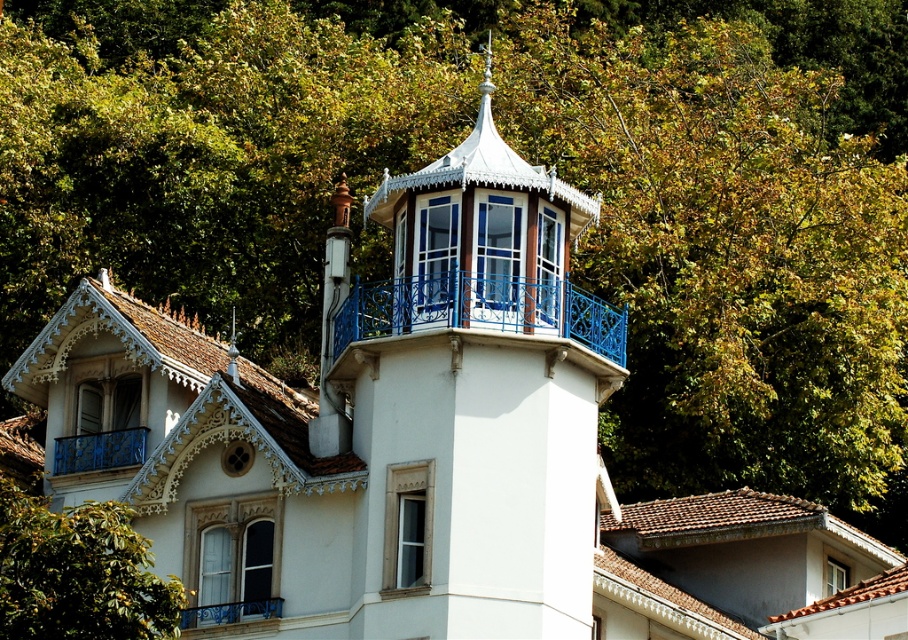
You are an architect assessing the building structure. You need to determine which of the two blue structures, the blue wrought iron balcony at center or the blue painted metal railing at lower left, is taller. Based on the scene, which one has a greater height?

The blue wrought iron balcony at center has a greater height compared to the blue painted metal railing at lower left.

You are a maintenance worker needing to inspect the blue wrought iron balcony at center and the blue painted metal railing at lower left. Given that your inspection equipment can only cover a maximum distance of 30 feet between inspection points, will you be able to inspect both areas without moving the equipment?

The distance between the blue wrought iron balcony at center and the blue painted metal railing at lower left is 31.11 feet, which exceeds the equipment limit of 30 feet. Therefore, you will need to move the equipment to inspect both areas.